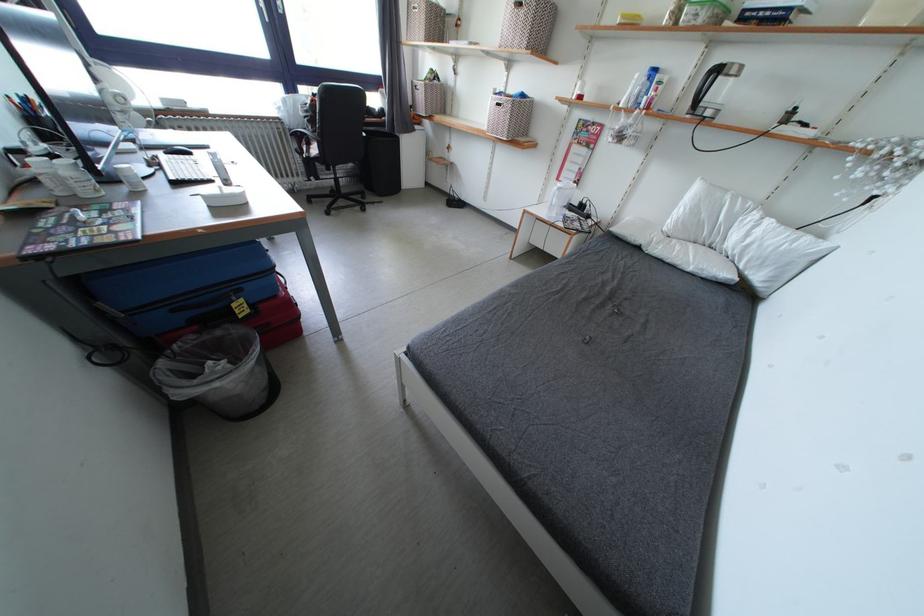
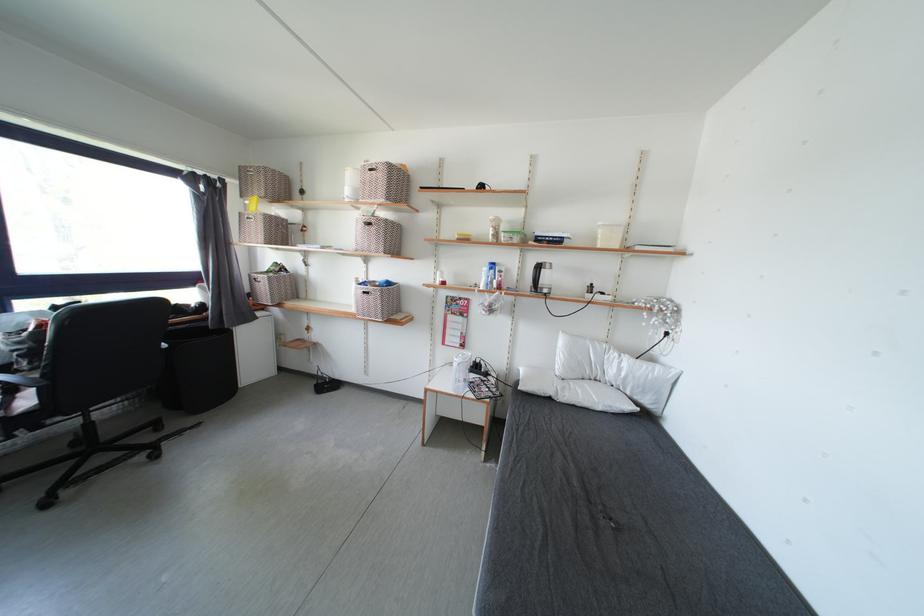
The point at (x=371, y=139) is marked in the first image. Where is the corresponding point in the second image?

(171, 350)